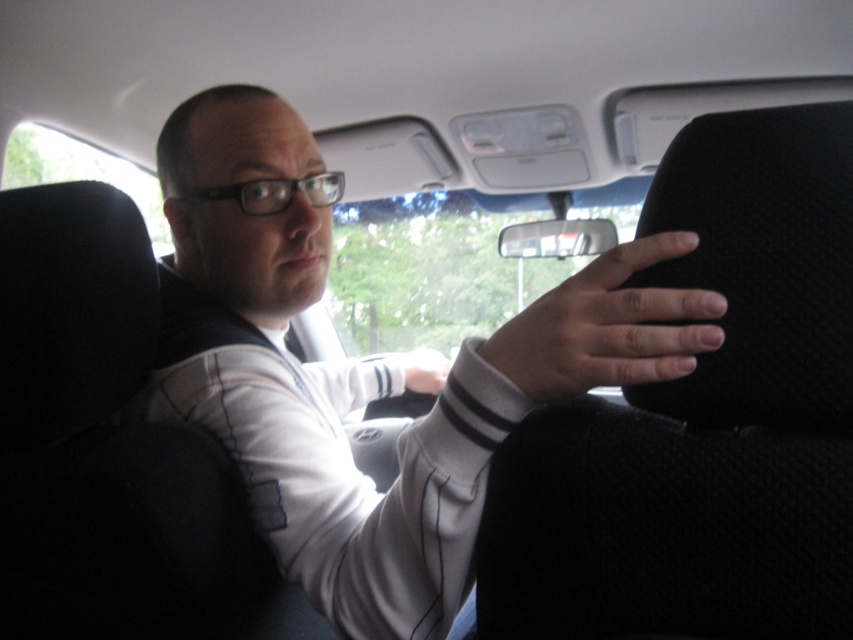
Is black fabric seat at center shorter than matte white hand at center?

No.

Which is in front, point (822, 161) or point (433, 388)?

Point (822, 161) is more forward.

Where is `black fabric seat at center`? The image size is (853, 640). black fabric seat at center is located at coordinates (704, 420).

Which of these two, black fabric seat at center or smooth skin hand at right, stands shorter?

smooth skin hand at right

Which is below, black fabric seat at center or smooth skin hand at right?

black fabric seat at center is lower down.

Between point (743, 273) and point (614, 275), which one is positioned behind?

The point (614, 275) is behind.

Locate an element on the screen. This screenshot has height=640, width=853. black fabric seat at center is located at coordinates (704, 420).

Is the position of smooth skin hand at right more distant than that of matte white hand at center?

No, smooth skin hand at right is closer to the viewer.

Which is in front, point (637, 266) or point (427, 369)?

Positioned in front is point (637, 266).

Is point (556, 369) closer to viewer compared to point (416, 356)?

Yes, it is in front of point (416, 356).

At what (x,y) coordinates should I click in order to perform the action: click on smooth skin hand at right. Please return your answer as a coordinate pair (x, y). The width and height of the screenshot is (853, 640). Looking at the image, I should click on (607, 326).